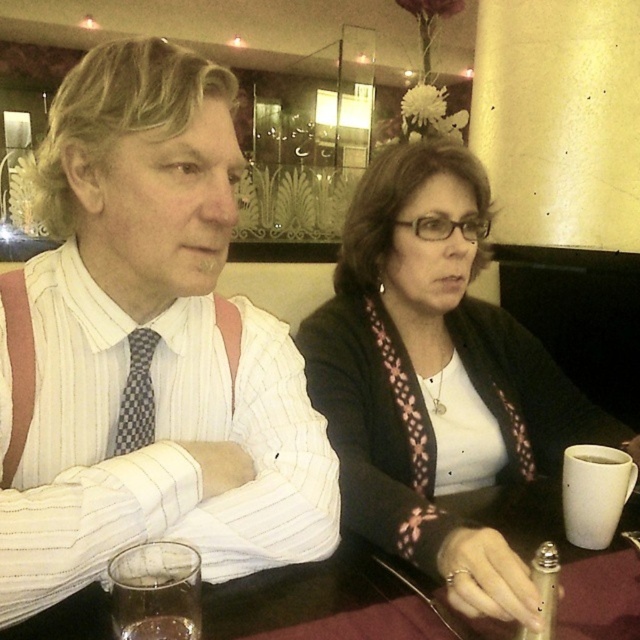
You are a fashion designer analyzing the outfit of the person on the left. You notice the white striped shirt at center and the checkered fabric tie at left. Which clothing item is positioned higher on this person?

The white striped shirt at center is positioned higher on the person than the checkered fabric tie at left because it is located above it.

Consider the image. You are a fashion designer observing two outfits in a photo. You see a white striped shirt at center and a white matte sweater at center. Which of these two items has a narrower width?

The white striped shirt at center has a lesser width compared to the white matte sweater at center, so the white striped shirt at center is narrower.

You are standing in a restaurant and want to take a photo of the point at coordinates point (273,541). Your camera has a focal length of 35mm and a sensor size of 24mm. What is the minimum distance you need to move closer to ensure the point fills the frame?

To calculate the required distance, use the formula Distance_new Distance_original x sensor_size_new sensor_size_original. Here, the point is 28.72 inches away. To fill the frame, the sensor size must match the object size. Assuming the object size at 28.72 inches is 24mm, rearranging gives Distance_new 28.72 x 24 24 28.72 inches. Thus, you don t need to move closer.